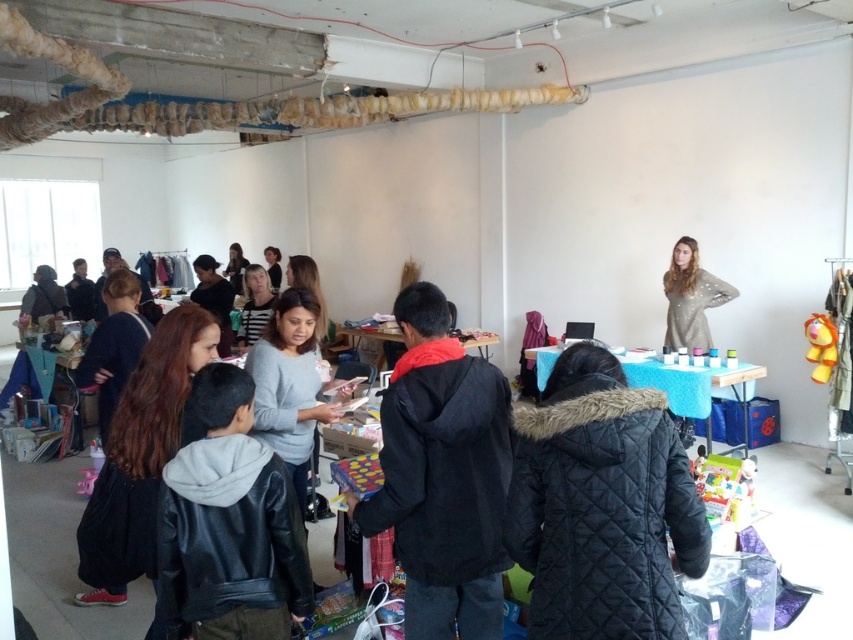
Is black quilted coat at lower center to the right of gray matte sweater at center from the viewer's perspective?

Yes, black quilted coat at lower center is to the right of gray matte sweater at center.

Which is above, black quilted coat at lower center or gray matte sweater at center?

gray matte sweater at center is above.

Image resolution: width=853 pixels, height=640 pixels. What do you see at coordinates (601, 506) in the screenshot?
I see `black quilted coat at lower center` at bounding box center [601, 506].

Identify the location of black quilted coat at lower center. (601, 506).

Measure the distance between matte gray sweater at center and camera.

They are 10.35 feet apart.

The width and height of the screenshot is (853, 640). I want to click on matte gray sweater at center, so click(308, 288).

Does point (310, 275) come behind point (231, 244)?

No, (310, 275) is closer to viewer.

Identify the location of matte gray sweater at center. The width and height of the screenshot is (853, 640). (308, 288).

Which is more to the left, gray matte sweater at center or striped shirt at center?

Positioned to the left is striped shirt at center.

Is gray matte sweater at center smaller than striped shirt at center?

Incorrect, gray matte sweater at center is not smaller in size than striped shirt at center.

Find the location of a particular element. The width and height of the screenshot is (853, 640). gray matte sweater at center is located at coordinates (289, 384).